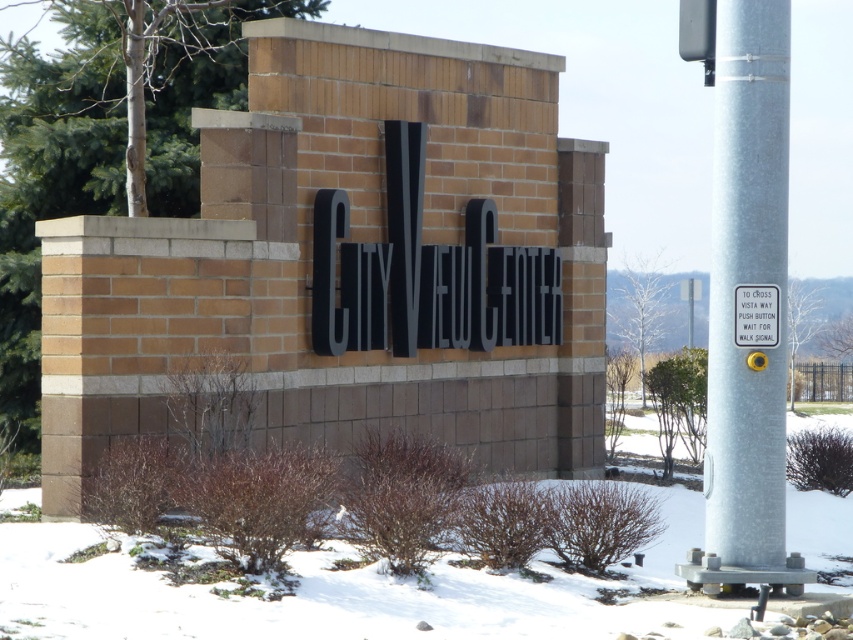
Image resolution: width=853 pixels, height=640 pixels. What do you see at coordinates (347, 593) in the screenshot? I see `white powdery snow at center` at bounding box center [347, 593].

Is white powdery snow at center shorter than white plastic sign at upper right?

In fact, white powdery snow at center may be taller than white plastic sign at upper right.

Which is behind, point (44, 564) or point (769, 332)?

Point (769, 332)

Where is `white powdery snow at center`? The width and height of the screenshot is (853, 640). white powdery snow at center is located at coordinates (347, 593).

Can you confirm if silver metallic pole at right is positioned to the left of white plastic sign at upper right?

Yes, silver metallic pole at right is to the left of white plastic sign at upper right.

Based on the photo, does silver metallic pole at right come behind white plastic sign at upper right?

No.

Locate an element on the screen. silver metallic pole at right is located at coordinates (732, 305).

You are a GUI agent. You are given a task and a screenshot of the screen. Output one action in this format:
    pyautogui.click(x=<x>, y=<y>)
    Task: Click on the silver metallic pole at right
    This screenshot has width=853, height=640.
    Given the screenshot: What is the action you would take?
    pyautogui.click(x=732, y=305)

Is white powdery snow at center taller than silver metallic pole at right?

No, white powdery snow at center is not taller than silver metallic pole at right.

Is white powdery snow at center to the right of silver metallic pole at right from the viewer's perspective?

Correct, you'll find white powdery snow at center to the right of silver metallic pole at right.

At what (x,y) coordinates should I click in order to perform the action: click on white powdery snow at center. Please return your answer as a coordinate pair (x, y). Image resolution: width=853 pixels, height=640 pixels. Looking at the image, I should click on (347, 593).